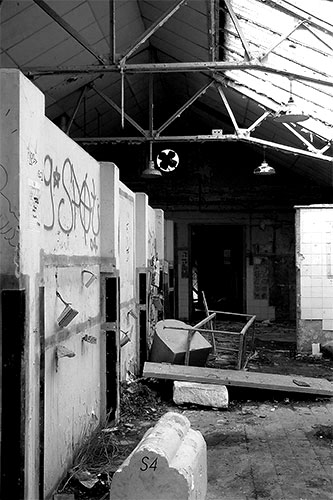
You are a GUI agent. You are given a task and a screenshot of the screen. Output one action in this format:
    pyautogui.click(x=<x>, y=<y>)
    Task: Click on the ceiling
    This screenshot has width=333, height=500.
    Given the screenshot: What is the action you would take?
    pyautogui.click(x=57, y=79)